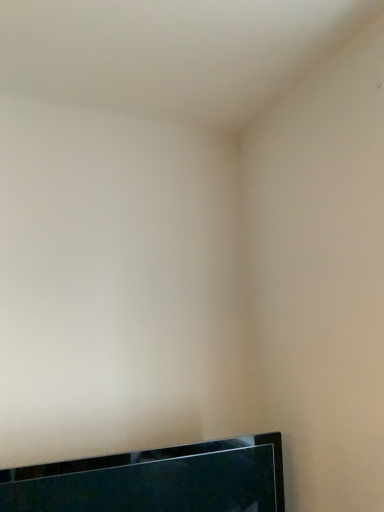
Question: Should I look upward or downward to see black glossy tv at bottom?

Choices:
 (A) up
 (B) down

Answer: (B)